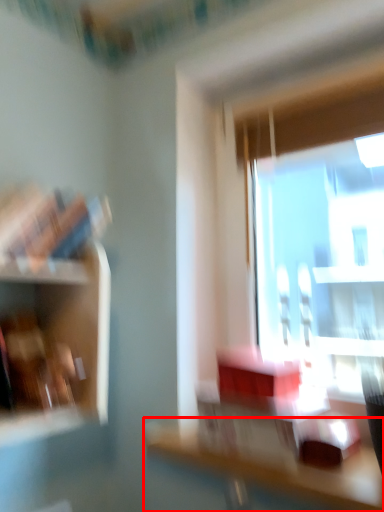
Question: From the image's perspective, what is the correct spatial relationship of table (annotated by the red box) in relation to shelf?

Choices:
 (A) below
 (B) above

Answer: (A)